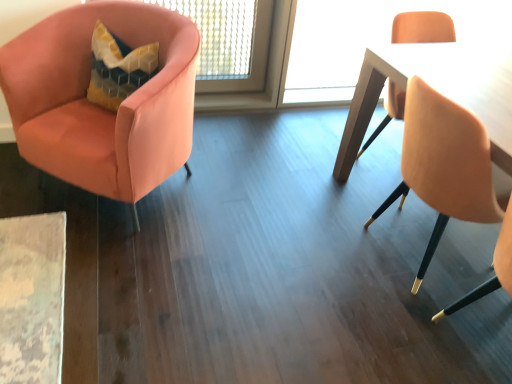
Measure the distance between point (178, 139) and camera.

Point (178, 139) is 6.62 feet away from camera.

What do you see at coordinates (443, 164) in the screenshot?
I see `matte gold chair at right, which appears as the second chair when viewed from the left` at bounding box center [443, 164].

The width and height of the screenshot is (512, 384). In order to click on satin pink armchair at left, which is the first chair in left-to-right order in this screenshot , I will do `click(98, 107)`.

In terms of width, does wooden table at right look wider or thinner when compared to satin pink armchair at left, which is the first chair in left-to-right order?

In the image, wooden table at right appears to be more narrow than satin pink armchair at left, which is the first chair in left-to-right order.

Based on the photo, can you confirm if wooden table at right is taller than satin pink armchair at left, acting as the 2th chair starting from the right?

Correct, wooden table at right is much taller as satin pink armchair at left, acting as the 2th chair starting from the right.

Can you confirm if wooden table at right is bigger than satin pink armchair at left, which is the first chair in left-to-right order?

Actually, wooden table at right might be smaller than satin pink armchair at left, which is the first chair in left-to-right order.

Looking at this image, would you consider wooden table at right to be distant from satin pink armchair at left, which is the first chair in left-to-right order?

wooden table at right is positioned a significant distance from satin pink armchair at left, which is the first chair in left-to-right order.

Can you confirm if wooden table at right is bigger than matte gold chair at right, the first chair when ordered from right to left?

Yes, wooden table at right is bigger than matte gold chair at right, the first chair when ordered from right to left.

Who is taller, wooden table at right or matte gold chair at right, the first chair when ordered from right to left?

Standing taller between the two is wooden table at right.

Is wooden table at right placed right next to matte gold chair at right, which appears as the second chair when viewed from the left?

There is a gap between wooden table at right and matte gold chair at right, which appears as the second chair when viewed from the left.

Is matte gold chair at right, the first chair when ordered from right to left, wider than wooden table at right?

No, matte gold chair at right, the first chair when ordered from right to left, is not wider than wooden table at right.

Which is more to the right, matte gold chair at right, which appears as the second chair when viewed from the left, or wooden table at right?

From the viewer's perspective, wooden table at right appears more on the right side.

Is matte gold chair at right, which appears as the second chair when viewed from the left, outside of wooden table at right?

Absolutely, matte gold chair at right, which appears as the second chair when viewed from the left, is external to wooden table at right.

Considering the sizes of matte gold chair at right, which appears as the second chair when viewed from the left, and wooden table at right in the image, is matte gold chair at right, which appears as the second chair when viewed from the left, taller or shorter than wooden table at right?

Clearly, matte gold chair at right, which appears as the second chair when viewed from the left, is shorter compared to wooden table at right.

How different are the orientations of matte gold chair at right, which appears as the second chair when viewed from the left, and satin pink armchair at left, which is the first chair in left-to-right order, in degrees?

They differ by 134 degrees in their facing directions.

Is matte gold chair at right, which appears as the second chair when viewed from the left, next to satin pink armchair at left, which is the first chair in left-to-right order, and touching it?

No, matte gold chair at right, which appears as the second chair when viewed from the left, is not touching satin pink armchair at left, which is the first chair in left-to-right order.

Is matte gold chair at right, the first chair when ordered from right to left, taller or shorter than satin pink armchair at left, which is the first chair in left-to-right order?

In the image, matte gold chair at right, the first chair when ordered from right to left, appears to be taller than satin pink armchair at left, which is the first chair in left-to-right order.

Where is `chair below the matte gold chair at right, the first chair when ordered from right to left (from a real-world perspective)`? The height and width of the screenshot is (384, 512). chair below the matte gold chair at right, the first chair when ordered from right to left (from a real-world perspective) is located at coordinates (98, 107).

Locate an element on the screen. This screenshot has height=384, width=512. table on the right of satin pink armchair at left, acting as the 2th chair starting from the right is located at coordinates (437, 89).

Is satin pink armchair at left, acting as the 2th chair starting from the right, completely or partially outside of wooden table at right?

Absolutely, satin pink armchair at left, acting as the 2th chair starting from the right, is external to wooden table at right.

Measure the distance from satin pink armchair at left, which is the first chair in left-to-right order, to wooden table at right.

A distance of 3.81 feet exists between satin pink armchair at left, which is the first chair in left-to-right order, and wooden table at right.

Which object is positioned more to the left, satin pink armchair at left, acting as the 2th chair starting from the right, or matte gold chair at right, the first chair when ordered from right to left?

satin pink armchair at left, acting as the 2th chair starting from the right, is more to the left.

Which of these two, satin pink armchair at left, acting as the 2th chair starting from the right, or matte gold chair at right, which appears as the second chair when viewed from the left, is thinner?

matte gold chair at right, which appears as the second chair when viewed from the left.

Who is taller, satin pink armchair at left, which is the first chair in left-to-right order, or matte gold chair at right, which appears as the second chair when viewed from the left?

matte gold chair at right, which appears as the second chair when viewed from the left.

Does point (104, 18) appear closer or farther from the camera than point (434, 113)?

Point (104, 18) appears to be farther away from the viewer than point (434, 113).

Where is `table on the right of satin pink armchair at left, acting as the 2th chair starting from the right`? The height and width of the screenshot is (384, 512). table on the right of satin pink armchair at left, acting as the 2th chair starting from the right is located at coordinates (437, 89).

Locate an element on the screen. table behind the matte gold chair at right, which appears as the second chair when viewed from the left is located at coordinates (437, 89).

Based on their spatial positions, is wooden table at right or satin pink armchair at left, acting as the 2th chair starting from the right, closer to matte gold chair at right, which appears as the second chair when viewed from the left?

wooden table at right is closer to matte gold chair at right, which appears as the second chair when viewed from the left.

When comparing their distances from satin pink armchair at left, acting as the 2th chair starting from the right, does matte gold chair at right, which appears as the second chair when viewed from the left, or wooden table at right seem closer?

The object closer to satin pink armchair at left, acting as the 2th chair starting from the right, is wooden table at right.

Consider the image. Based on their spatial positions, is satin pink armchair at left, acting as the 2th chair starting from the right, or matte gold chair at right, which appears as the second chair when viewed from the left, closer to wooden table at right?

matte gold chair at right, which appears as the second chair when viewed from the left, is positioned closer to the anchor wooden table at right.

Which object lies further to the anchor point satin pink armchair at left, which is the first chair in left-to-right order, wooden table at right or matte gold chair at right, which appears as the second chair when viewed from the left?

matte gold chair at right, which appears as the second chair when viewed from the left, is further to satin pink armchair at left, which is the first chair in left-to-right order.

From the image, which object appears to be nearer to matte gold chair at right, which appears as the second chair when viewed from the left, satin pink armchair at left, which is the first chair in left-to-right order, or wooden table at right?

wooden table at right.

Looking at the image, which one is located further to wooden table at right, matte gold chair at right, the first chair when ordered from right to left, or satin pink armchair at left, which is the first chair in left-to-right order?

Among the two, satin pink armchair at left, which is the first chair in left-to-right order, is located further to wooden table at right.

The height and width of the screenshot is (384, 512). Identify the location of chair situated between satin pink armchair at left, which is the first chair in left-to-right order, and wooden table at right from left to right. (443, 164).